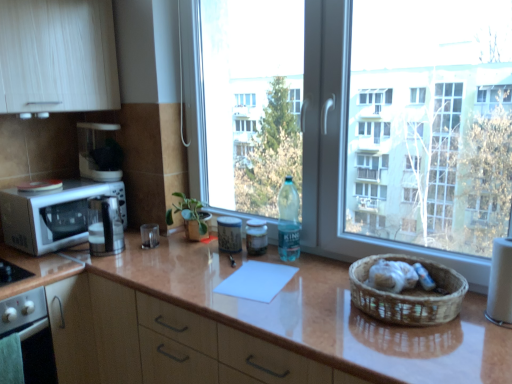
Find the location of a particular element. The image size is (512, 384). vacant space in between transparent glass window at center and brown woven basket at right is located at coordinates (314, 283).